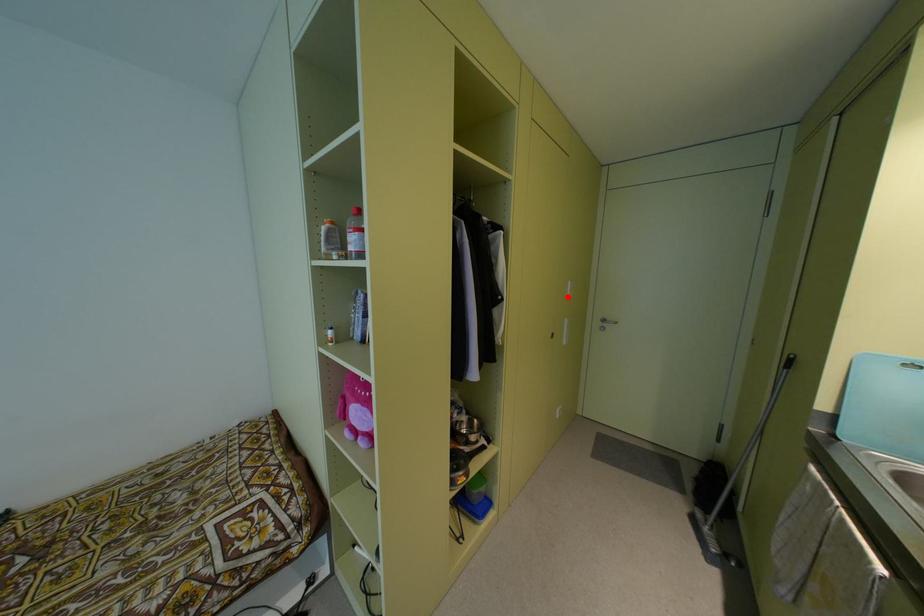
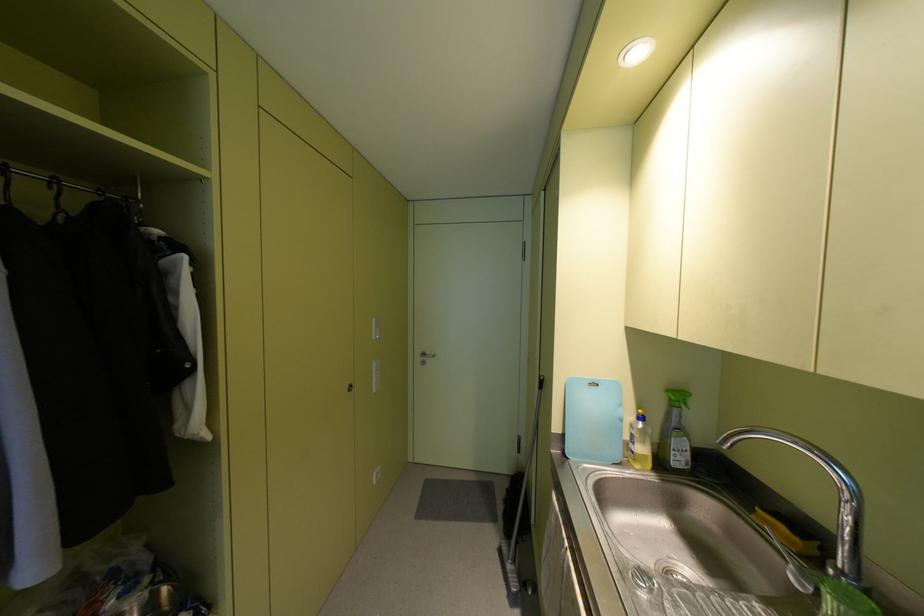
The point at the highlighted location is marked in the first image. Where is the corresponding point in the second image?

(373, 336)